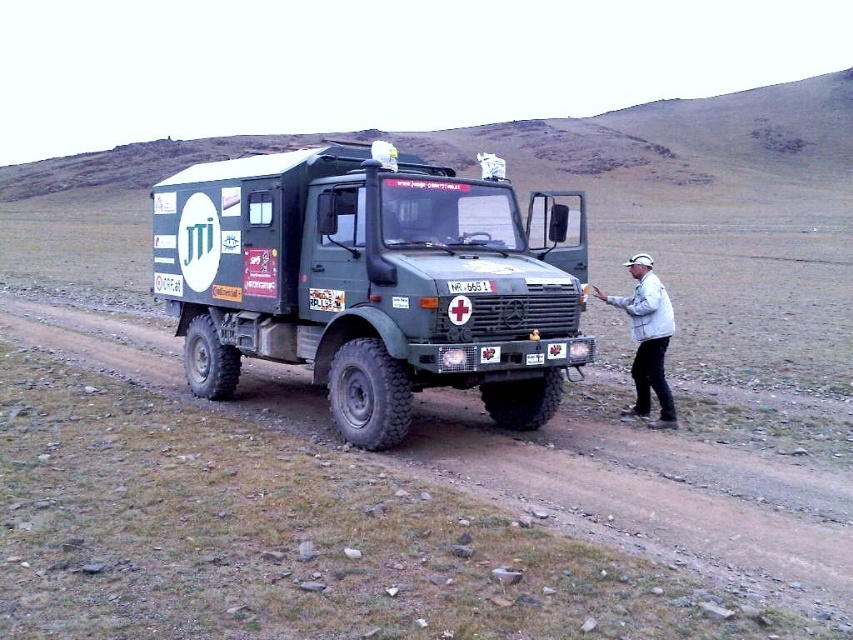
Who is positioned more to the left, green matte truck at center or white matte jacket at right?

From the viewer's perspective, green matte truck at center appears more on the left side.

Is green matte truck at center smaller than white matte jacket at right?

Yes, green matte truck at center is smaller than white matte jacket at right.

What do you see at coordinates (370, 284) in the screenshot? Image resolution: width=853 pixels, height=640 pixels. I see `green matte truck at center` at bounding box center [370, 284].

Locate an element on the screen. The width and height of the screenshot is (853, 640). green matte truck at center is located at coordinates (370, 284).

Can you confirm if green matte truck at center is thinner than brown dirt track at center?

Yes.

Does point (167, 246) come behind point (795, 472)?

Yes, it is behind point (795, 472).

Does point (254, 266) come in front of point (126, 342)?

Yes, point (254, 266) is closer to viewer.

You are a GUI agent. You are given a task and a screenshot of the screen. Output one action in this format:
    pyautogui.click(x=<x>, y=<y>)
    Task: Click on the green matte truck at center
    The width and height of the screenshot is (853, 640).
    Given the screenshot: What is the action you would take?
    pyautogui.click(x=370, y=284)

Does brown dirt track at center have a greater width compared to white matte jacket at right?

Indeed, brown dirt track at center has a greater width compared to white matte jacket at right.

Locate an element on the screen. brown dirt track at center is located at coordinates (653, 496).

The width and height of the screenshot is (853, 640). What do you see at coordinates (653, 496) in the screenshot?
I see `brown dirt track at center` at bounding box center [653, 496].

Where is `brown dirt track at center`? Image resolution: width=853 pixels, height=640 pixels. brown dirt track at center is located at coordinates pos(653,496).